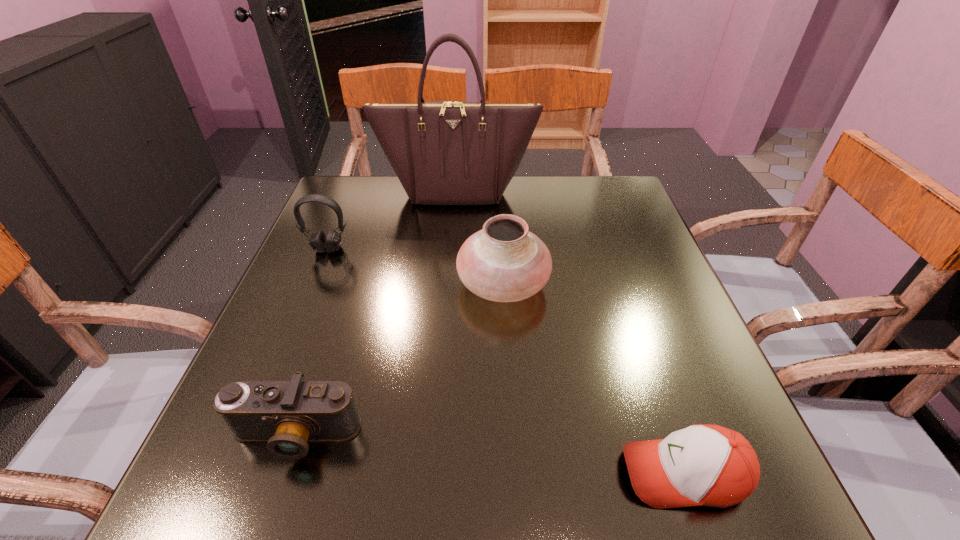
Find the location of a particular element. the tallest object is located at coordinates (448, 152).

The height and width of the screenshot is (540, 960). Find the location of `the farthest object`. the farthest object is located at coordinates (448, 152).

At what (x,y) coordinates should I click in order to perform the action: click on pottery. Please return your answer as a coordinate pair (x, y). This screenshot has height=540, width=960. Looking at the image, I should click on click(504, 262).

Find the location of a particular element. headset is located at coordinates (319, 242).

What are the coordinates of `camera` in the screenshot? It's located at (287, 414).

Where is `the rightmost object`? Image resolution: width=960 pixels, height=540 pixels. the rightmost object is located at coordinates (702, 465).

Identify the location of vacant region located on the front-facing side of the farthest object. (448, 294).

You are a GUI agent. You are given a task and a screenshot of the screen. Output one action in this format:
    pyautogui.click(x=<x>, y=<y>)
    Task: Click on the free space located 0.220m on the front of the pottery
    Image resolution: width=960 pixels, height=540 pixels.
    Given the screenshot: What is the action you would take?
    pyautogui.click(x=511, y=416)

The height and width of the screenshot is (540, 960). In order to click on vacant region located on the front-facing side of the headset in this screenshot , I will do `click(318, 275)`.

The width and height of the screenshot is (960, 540). What are the coordinates of `free space located 0.050m on the front-facing side of the baseball cap` in the screenshot? It's located at (588, 474).